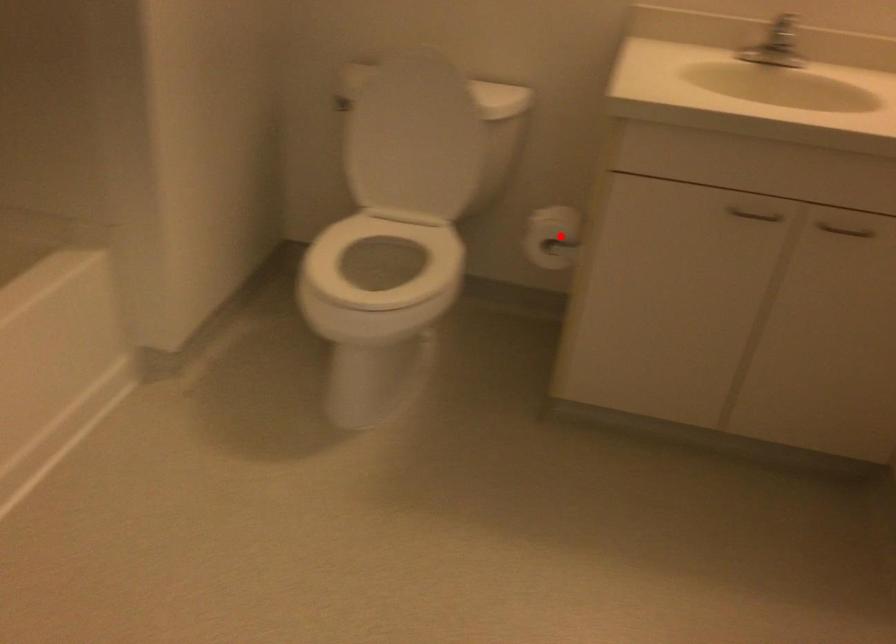
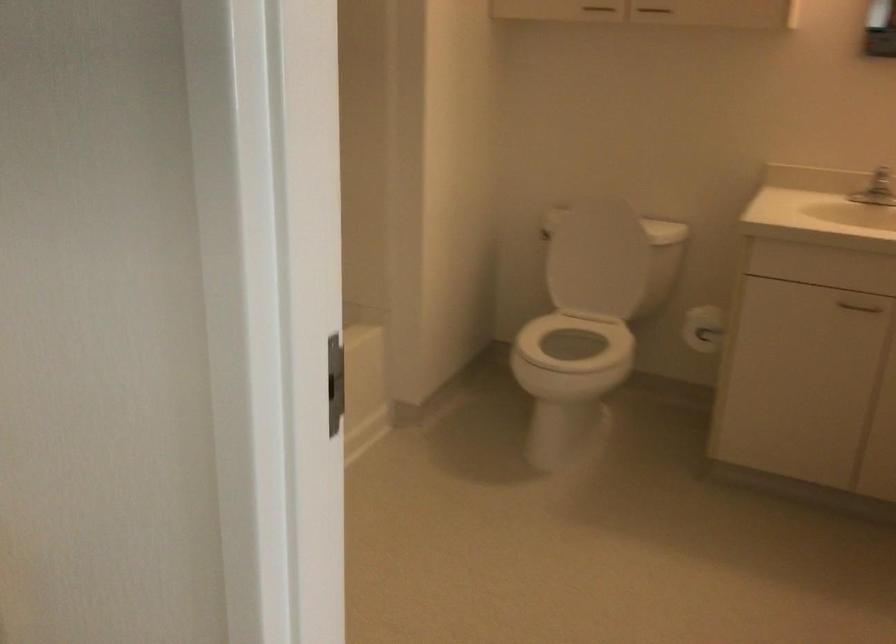
Locate, in the second image, the point that corresponds to the highlighted location in the first image.

(702, 328)